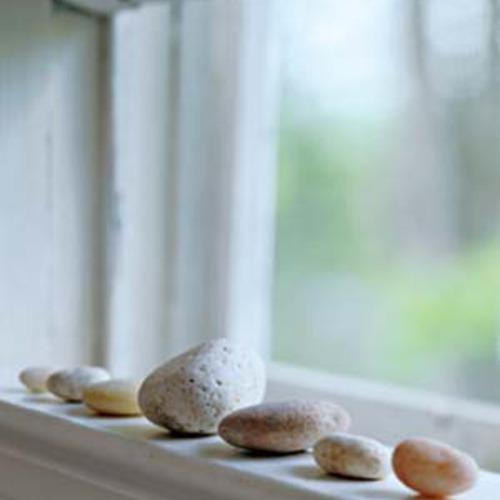
Identify the location of shadow of stone on windowsill. (387, 495), (309, 476), (221, 454), (159, 435), (82, 415), (46, 399), (17, 389).